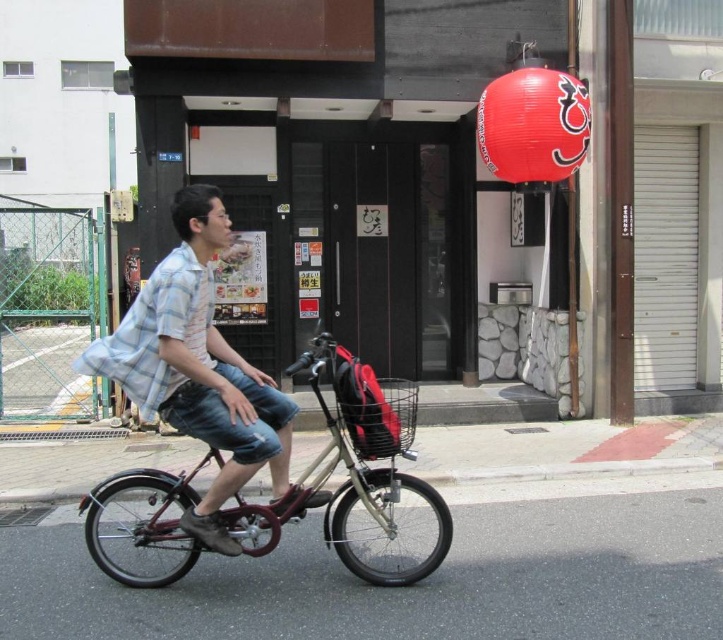
Which is below, metallic maroon bicycle at center or shiny red paper lantern at upper center?

metallic maroon bicycle at center

Does metallic maroon bicycle at center appear on the right side of shiny red paper lantern at upper center?

No, metallic maroon bicycle at center is not to the right of shiny red paper lantern at upper center.

Is point (150, 476) positioned after point (505, 148)?

No.

Where is `metallic maroon bicycle at center`? This screenshot has height=640, width=723. metallic maroon bicycle at center is located at coordinates (351, 467).

Who is higher up, light blue plaid shirt at center or metallic maroon bicycle at center?

light blue plaid shirt at center is higher up.

Does light blue plaid shirt at center have a lesser height compared to metallic maroon bicycle at center?

No, light blue plaid shirt at center is not shorter than metallic maroon bicycle at center.

Identify the location of light blue plaid shirt at center. (197, 365).

Measure the distance between point (132,324) and camera.

Point (132,324) and camera are 4.08 meters apart.

Which is more to the left, light blue plaid shirt at center or shiny red paper lantern at upper center?

Positioned to the left is light blue plaid shirt at center.

Is point (179, 316) closer to camera compared to point (479, 100)?

That is True.

Locate an element on the screen. This screenshot has width=723, height=640. light blue plaid shirt at center is located at coordinates (197, 365).